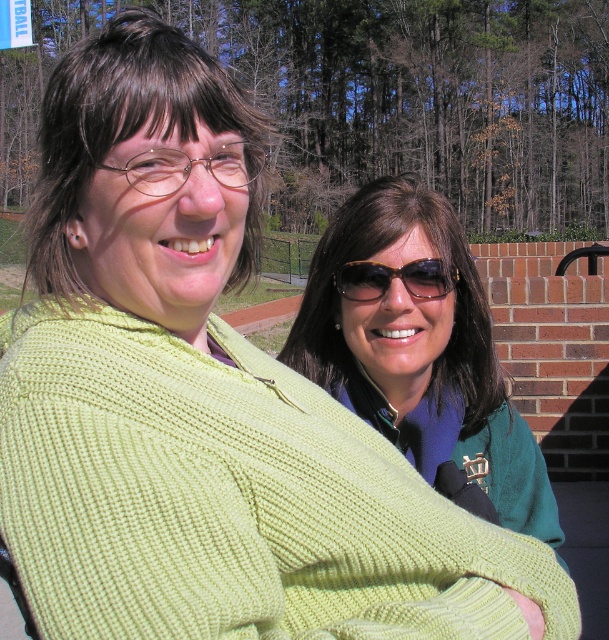
Question: Does green knitted sweater at center have a larger size compared to black reflective sunglasses at center?

Choices:
 (A) yes
 (B) no

Answer: (A)

Question: Does green knitted sweater at center appear under black reflective sunglasses at center?

Choices:
 (A) yes
 (B) no

Answer: (A)

Question: Which object appears farthest from the camera in this image?

Choices:
 (A) black reflective sunglasses at center
 (B) green knitted sweater at center

Answer: (A)

Question: Among these points, which one is nearest to the camera?

Choices:
 (A) (428, 436)
 (B) (375, 291)

Answer: (B)

Question: Does green knitted sweater at center appear under black reflective sunglasses at center?

Choices:
 (A) yes
 (B) no

Answer: (A)